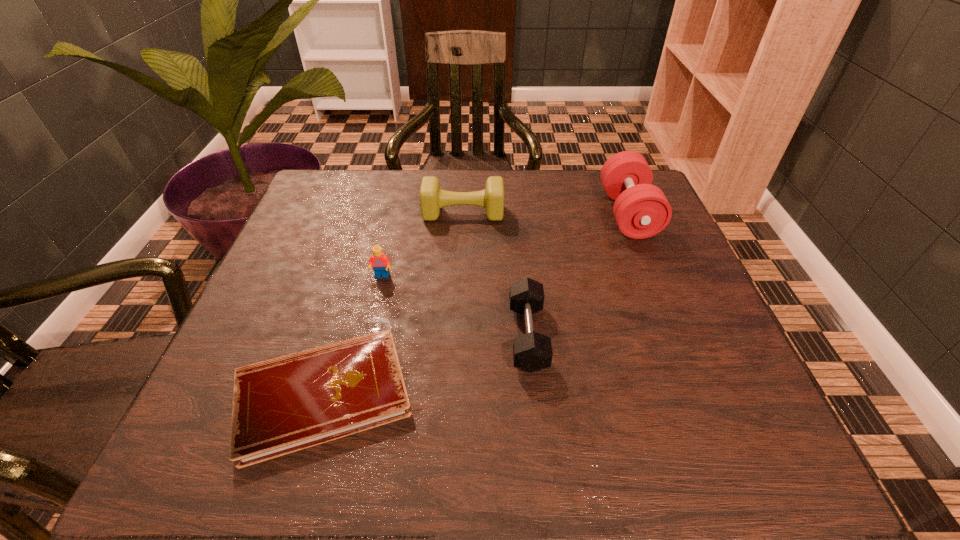
You are a GUI agent. You are given a task and a screenshot of the screen. Output one action in this format:
    pyautogui.click(x=<x>, y=<y>)
    Task: Click on the vacant space in between the third nearest object and the tallest dumbbell
    Image resolution: width=960 pixels, height=540 pixels.
    Given the screenshot: What is the action you would take?
    pyautogui.click(x=505, y=245)

Image resolution: width=960 pixels, height=540 pixels. Identify the location of the fourth closest object to the leftmost dumbbell. (283, 405).

The width and height of the screenshot is (960, 540). I want to click on the closest object to the rightmost dumbbell, so click(432, 198).

Find the location of a particular element. The height and width of the screenshot is (540, 960). dumbbell that is the closest to the Lego is located at coordinates (432, 198).

Select which dumbbell is the second closest to the notebook. Please provide its 2D coordinates. Your answer should be formatted as a tuple, i.e. [(x, y)], where the tuple contains the x and y coordinates of a point satisfying the conditions above.

[(432, 198)]

Where is `vacant position in the image that satisfies the following two spatial constraints: 1. on the back side of the shortest object; 2. on the right side of the leftmost dumbbell`? The height and width of the screenshot is (540, 960). vacant position in the image that satisfies the following two spatial constraints: 1. on the back side of the shortest object; 2. on the right side of the leftmost dumbbell is located at coordinates (375, 213).

Where is `free location that satisfies the following two spatial constraints: 1. on the face of the second dumbbell from right to left; 2. on the left side of the third farthest object`? free location that satisfies the following two spatial constraints: 1. on the face of the second dumbbell from right to left; 2. on the left side of the third farthest object is located at coordinates (369, 336).

This screenshot has height=540, width=960. Find the location of `free spot that satisfies the following two spatial constraints: 1. on the face of the second object from right to left; 2. on the right side of the Lego`. free spot that satisfies the following two spatial constraints: 1. on the face of the second object from right to left; 2. on the right side of the Lego is located at coordinates (369, 336).

The width and height of the screenshot is (960, 540). In order to click on free point that satisfies the following two spatial constraints: 1. on the face of the second dumbbell from left to right; 2. on the right side of the Lego in this screenshot , I will do `click(369, 336)`.